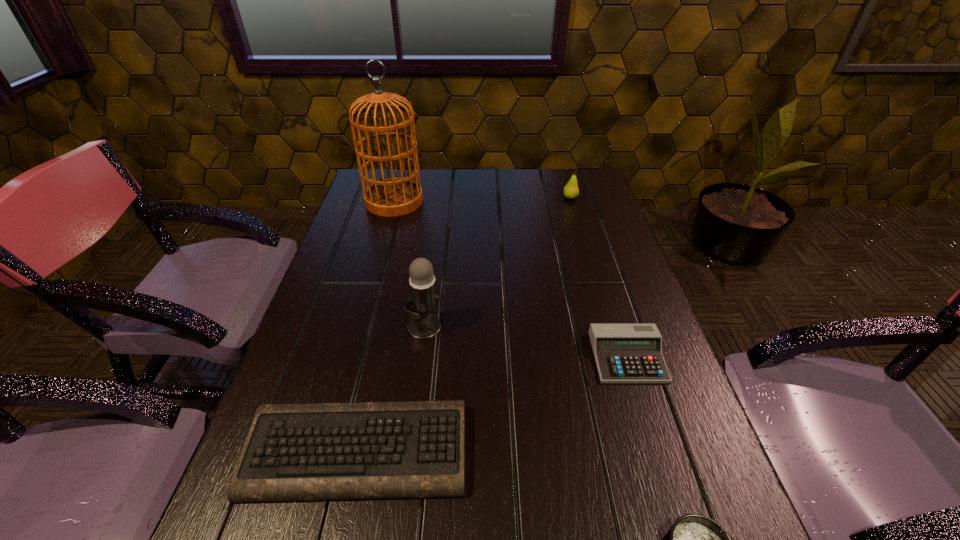
The width and height of the screenshot is (960, 540). What are the coordinates of `birdcage` in the screenshot? It's located at (390, 197).

Find the location of `the fifth shortest object`. the fifth shortest object is located at coordinates 422,325.

This screenshot has width=960, height=540. I want to click on pear, so click(x=571, y=191).

Where is `calculator`? The height and width of the screenshot is (540, 960). calculator is located at coordinates (624, 352).

The height and width of the screenshot is (540, 960). In order to click on the second nearest object in this screenshot , I will do `click(372, 450)`.

What are the coordinates of `free location located 0.120m on the right of the birdcage` in the screenshot? It's located at click(459, 201).

Image resolution: width=960 pixels, height=540 pixels. Identify the location of vacant region located 0.240m on the left of the microphone. (304, 326).

Locate an element on the screen. vacant space located 0.120m on the back of the third tallest object is located at coordinates (564, 176).

Where is `vacant space located 0.320m on the left of the calculator`? vacant space located 0.320m on the left of the calculator is located at coordinates (447, 357).

Identify the location of vacant space located 0.240m on the right of the fifth farthest object. This screenshot has height=540, width=960. (598, 451).